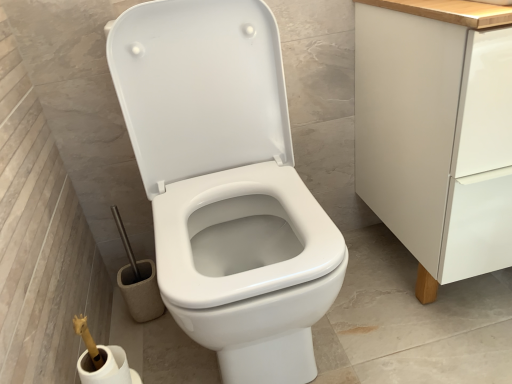
Question: Can you see white glossy toilet at center touching white matte toilet paper at lower left?

Choices:
 (A) no
 (B) yes

Answer: (A)

Question: From the image's perspective, would you say white glossy toilet at center is positioned over white matte toilet paper at lower left?

Choices:
 (A) no
 (B) yes

Answer: (B)

Question: Can you confirm if white glossy toilet at center is taller than white matte toilet paper at lower left?

Choices:
 (A) yes
 (B) no

Answer: (A)

Question: Does white glossy toilet at center have a lesser height compared to white matte toilet paper at lower left?

Choices:
 (A) no
 (B) yes

Answer: (A)

Question: Is white glossy toilet at center positioned beyond the bounds of white matte toilet paper at lower left?

Choices:
 (A) yes
 (B) no

Answer: (A)

Question: Considering the positions of point (385, 203) and point (186, 142), is point (385, 203) closer or farther from the camera than point (186, 142)?

Choices:
 (A) farther
 (B) closer

Answer: (A)

Question: In terms of width, does white matte cabinet at right look wider or thinner when compared to white glossy toilet at center?

Choices:
 (A) thin
 (B) wide

Answer: (A)

Question: Is white matte cabinet at right situated inside white glossy toilet at center or outside?

Choices:
 (A) outside
 (B) inside

Answer: (A)

Question: Considering the positions of white matte cabinet at right and white glossy toilet at center in the image, is white matte cabinet at right bigger or smaller than white glossy toilet at center?

Choices:
 (A) big
 (B) small

Answer: (A)

Question: From a real-world perspective, is white matte toilet paper at lower left physically located above or below white glossy toilet at center?

Choices:
 (A) below
 (B) above

Answer: (A)

Question: In terms of size, does white matte toilet paper at lower left appear bigger or smaller than white glossy toilet at center?

Choices:
 (A) small
 (B) big

Answer: (A)

Question: Is white matte toilet paper at lower left taller or shorter than white glossy toilet at center?

Choices:
 (A) short
 (B) tall

Answer: (A)

Question: Is white matte toilet paper at lower left situated inside white glossy toilet at center or outside?

Choices:
 (A) outside
 (B) inside

Answer: (A)

Question: Considering the positions of white matte cabinet at right and white matte toilet paper at lower left in the image, is white matte cabinet at right taller or shorter than white matte toilet paper at lower left?

Choices:
 (A) short
 (B) tall

Answer: (B)

Question: From the image's perspective, is white matte cabinet at right above or below white matte toilet paper at lower left?

Choices:
 (A) above
 (B) below

Answer: (A)